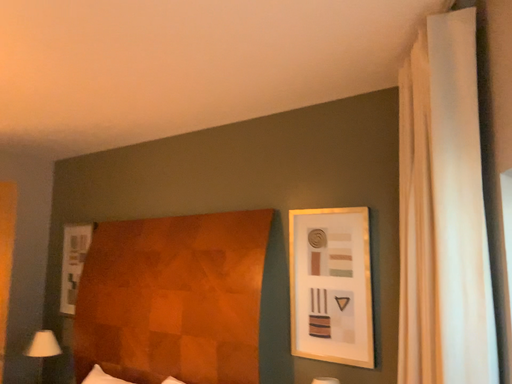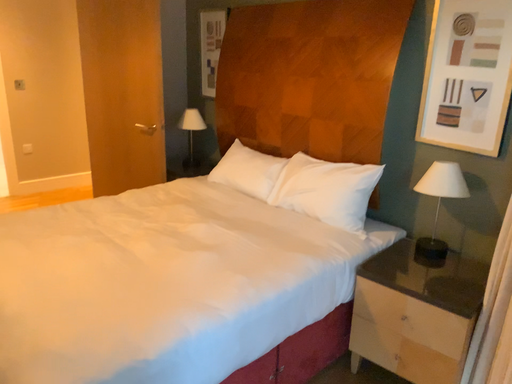
Question: Which way did the camera rotate in the video?

Choices:
 (A) rotated upward
 (B) rotated downward

Answer: (B)